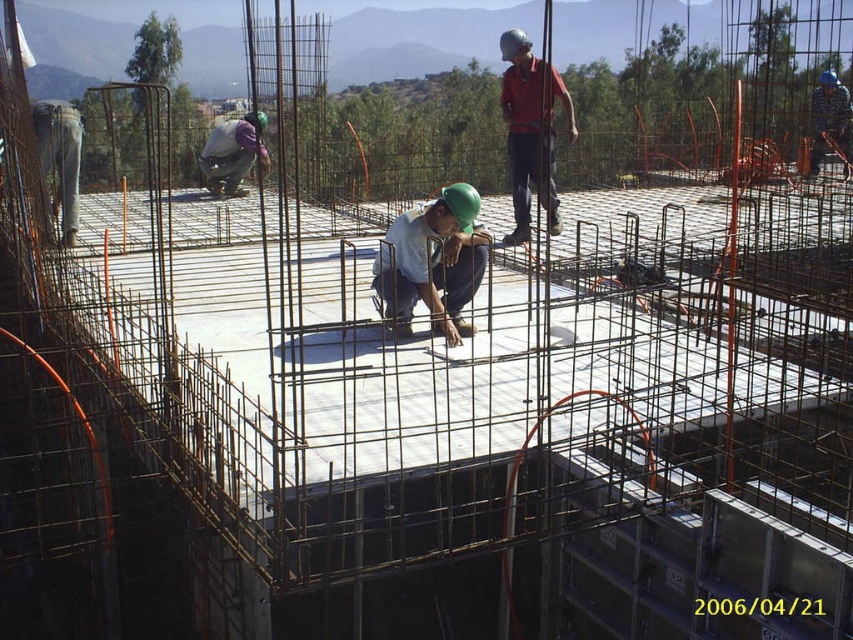
Question: Which object appears farthest from the camera in this image?

Choices:
 (A) gray fabric worker at center
 (B) red matte shirt at upper center
 (C) green hard hat at center

Answer: (A)

Question: Can you confirm if red matte shirt at upper center is wider than gray fabric worker at center?

Choices:
 (A) no
 (B) yes

Answer: (A)

Question: Can you confirm if green hard hat at center is smaller than gray fabric worker at center?

Choices:
 (A) no
 (B) yes

Answer: (B)

Question: Estimate the real-world distances between objects in this image. Which object is farther from the gray fabric worker at center?

Choices:
 (A) green hard hat at center
 (B) red matte shirt at upper center

Answer: (A)

Question: Which point appears closest to the camera in this image?

Choices:
 (A) (422, 269)
 (B) (547, 72)

Answer: (B)

Question: Is green hard hat at center above red matte shirt at upper center?

Choices:
 (A) no
 (B) yes

Answer: (A)